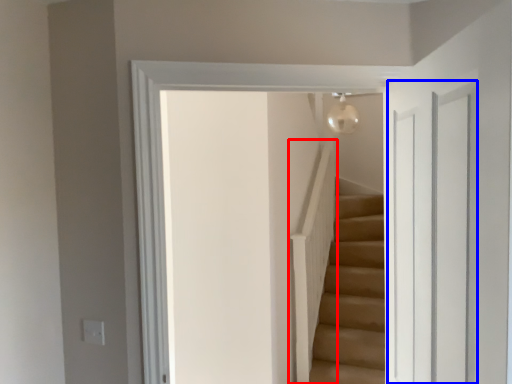
Question: Which object is further to the camera taking this photo, balustrade (highlighted by a red box) or glass door (highlighted by a blue box)?

Choices:
 (A) balustrade
 (B) glass door

Answer: (A)